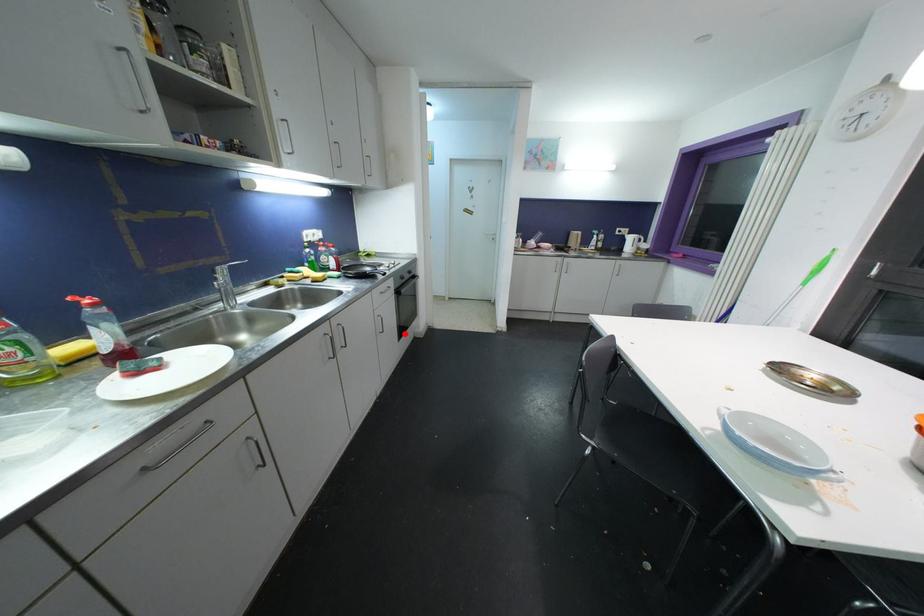
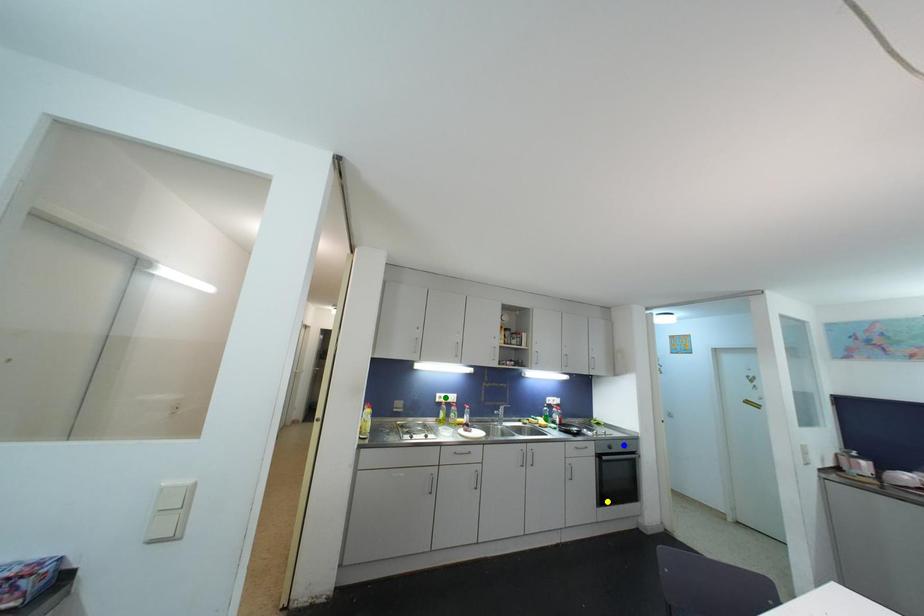
Question: I am providing you with two images of the same scene from different viewpoints. A red point is marked on the first image. You are given multiple points on the second image. Which mark in image 2 goes with the point in image 1?

Choices:
 (A) blue point
 (B) yellow point
 (C) green point

Answer: (B)